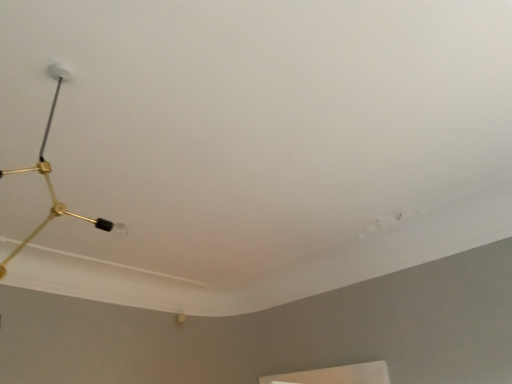
This screenshot has height=384, width=512. What do you see at coordinates (49, 177) in the screenshot? I see `gold metallic lamp at upper left` at bounding box center [49, 177].

I want to click on gold metallic lamp at upper left, so pos(49,177).

This screenshot has height=384, width=512. Identify the location of gold metallic lamp at upper left. (49, 177).